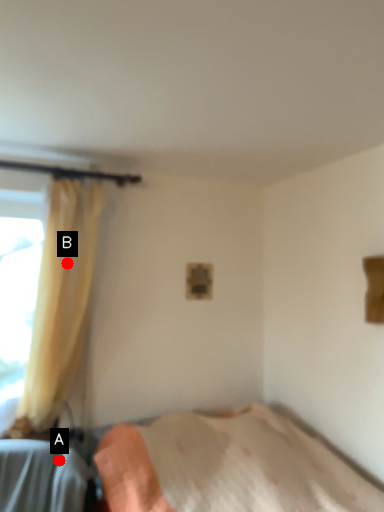
Question: Two points are circled on the image, labeled by A and B beside each circle. Which point is closer to the camera taking this photo?

Choices:
 (A) A is closer
 (B) B is closer

Answer: (A)